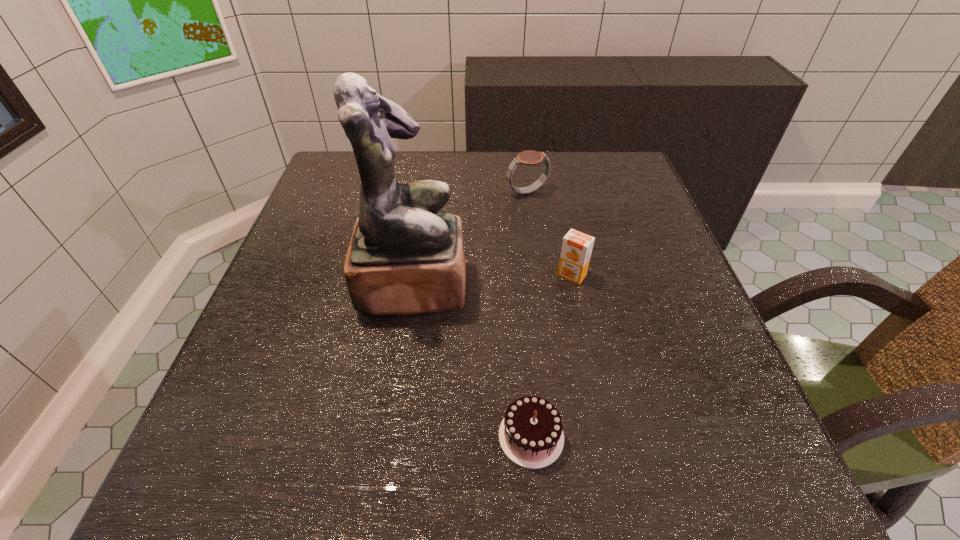
This screenshot has width=960, height=540. In order to click on vacant space that is in between the shortest object and the leftmost object in this screenshot , I will do `click(472, 360)`.

At what (x,y) coordinates should I click in order to perform the action: click on empty space between the nearest object and the orange juice. Please return your answer as a coordinate pair (x, y). Image resolution: width=960 pixels, height=540 pixels. Looking at the image, I should click on [x=552, y=356].

This screenshot has width=960, height=540. Find the location of `empty space that is in between the sculpture and the orange juice`. empty space that is in between the sculpture and the orange juice is located at coordinates (492, 280).

This screenshot has height=540, width=960. In order to click on free space that is in between the nearest object and the orange juice in this screenshot , I will do `click(552, 356)`.

Where is `free space between the watch and the shortest object`? free space between the watch and the shortest object is located at coordinates (529, 314).

Where is `free space that is in between the sculpture and the shortest object`? free space that is in between the sculpture and the shortest object is located at coordinates (472, 360).

Where is `free space between the chocolate cake and the farthest object`? free space between the chocolate cake and the farthest object is located at coordinates (529, 314).

The height and width of the screenshot is (540, 960). Identify the location of empty space that is in between the orange juice and the watch. (549, 234).

Locate an element on the screen. object that is the third closest to the orange juice is located at coordinates (531, 435).

Identify which object is located as the third nearest to the orange juice. Please provide its 2D coordinates. Your answer should be formatted as a tuple, i.e. [(x, y)], where the tuple contains the x and y coordinates of a point satisfying the conditions above.

[(531, 435)]